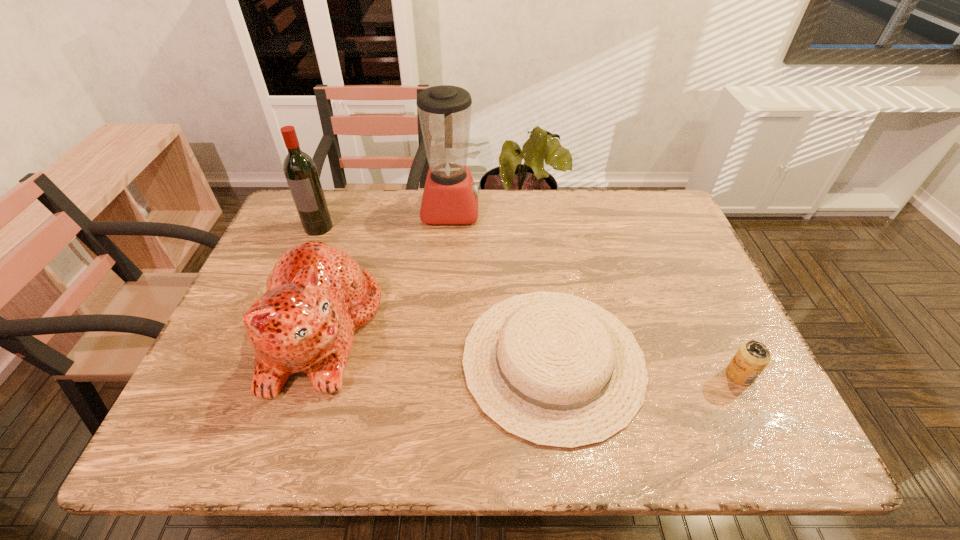
The height and width of the screenshot is (540, 960). Find the location of `free space located on the back of the sunhat`. free space located on the back of the sunhat is located at coordinates pyautogui.click(x=532, y=209).

This screenshot has height=540, width=960. I want to click on blender positioned at the far edge, so click(450, 196).

I want to click on wine bottle present at the far edge, so click(300, 170).

Identify the location of object that is at the near edge. This screenshot has height=540, width=960. (556, 370).

What are the coordinates of `wine bottle that is positioned at the left edge` in the screenshot? It's located at (300, 170).

Find the location of a particular element. This screenshot has height=540, width=960. cat located in the left edge section of the desktop is located at coordinates (317, 296).

You are a GUI agent. You are given a task and a screenshot of the screen. Output one action in this format:
    pyautogui.click(x=<x>, y=<y>)
    Task: Click on the object that is positioned at the right edge
    
    Given the screenshot: What is the action you would take?
    pyautogui.click(x=752, y=357)

The height and width of the screenshot is (540, 960). Identify the location of object located at the far left corner. (300, 170).

In the image, there is a desktop. At what (x,y) coordinates should I click in order to perform the action: click on vacant region at the far edge. Please return your answer as a coordinate pair (x, y). The height and width of the screenshot is (540, 960). Looking at the image, I should click on (395, 224).

The width and height of the screenshot is (960, 540). What are the coordinates of `free space at the near edge of the desktop` in the screenshot? It's located at (503, 448).